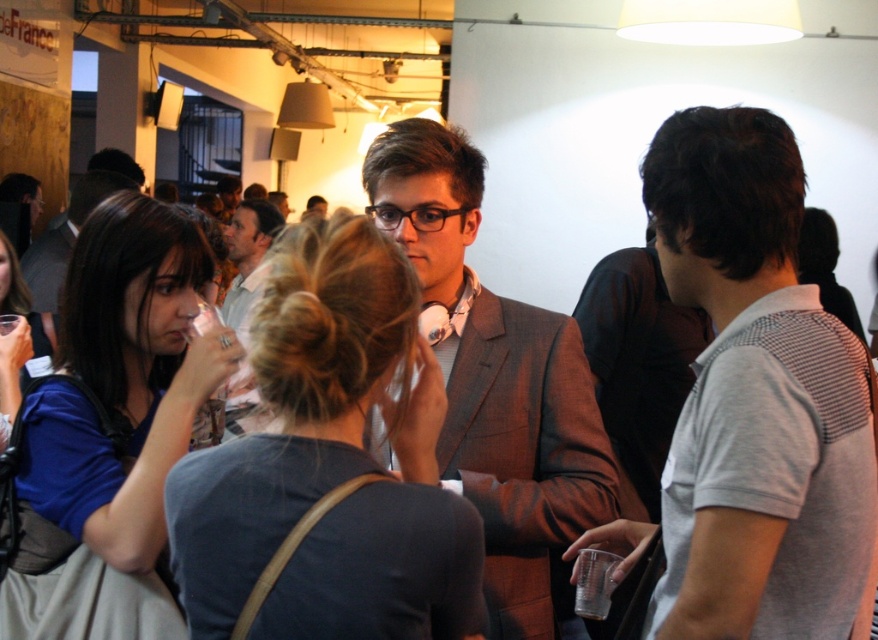
Does point (725, 529) come farther from viewer compared to point (372, 198)?

No, it is in front of (372, 198).

Between gray mesh polo shirt at right and gray wool suit at center, which one appears on the left side from the viewer's perspective?

gray wool suit at center

What do you see at coordinates (757, 400) in the screenshot?
I see `gray mesh polo shirt at right` at bounding box center [757, 400].

Where is `gray mesh polo shirt at right`? The width and height of the screenshot is (878, 640). gray mesh polo shirt at right is located at coordinates (757, 400).

Who is more forward, (x=473, y=148) or (x=56, y=234)?

Point (x=473, y=148) is in front.

Between point (488, 483) and point (40, 244), which one is positioned behind?

The point (40, 244) is more distant.

Who is more distant from viewer, (450, 476) or (76, 234)?

Point (76, 234)

The height and width of the screenshot is (640, 878). In order to click on gray wool suit at center in this screenshot , I will do `click(495, 380)`.

This screenshot has height=640, width=878. What do you see at coordinates (757, 400) in the screenshot? I see `gray mesh polo shirt at right` at bounding box center [757, 400].

Is the position of gray mesh polo shirt at right less distant than that of matte white shirt at center?

Yes, gray mesh polo shirt at right is in front of matte white shirt at center.

Is point (781, 276) behind point (243, 280)?

No, it is in front of (243, 280).

The height and width of the screenshot is (640, 878). Find the location of `gray mesh polo shirt at right`. gray mesh polo shirt at right is located at coordinates (757, 400).